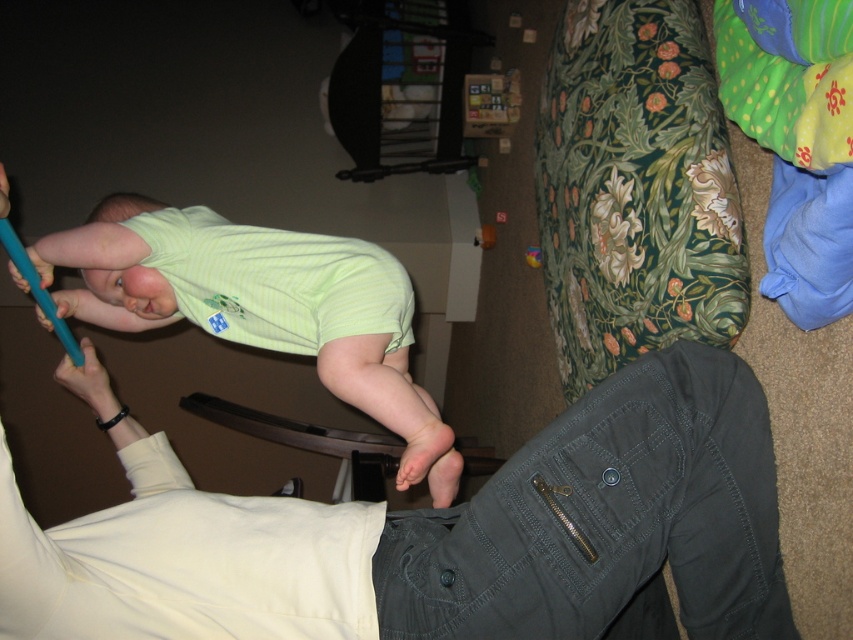
Which is behind, point (73, 256) or point (76, 300)?

Positioned behind is point (76, 300).

Which is behind, point (155, 220) or point (74, 308)?

The point (74, 308) is behind.

At what (x,y) coordinates should I click in order to perform the action: click on light green fabric at upper left. Please return your answer as a coordinate pair (x, y). This screenshot has height=640, width=853. Looking at the image, I should click on (277, 278).

Measure the distance between dark gray pants at lower right and camera.

dark gray pants at lower right is 32.38 inches away from camera.

Is dark gray pants at lower right further to the viewer compared to pink matte flesh at center?

No, dark gray pants at lower right is closer to the viewer.

Locate an element on the screen. Image resolution: width=853 pixels, height=640 pixels. dark gray pants at lower right is located at coordinates (439, 534).

This screenshot has height=640, width=853. What are the coordinates of `dark gray pants at lower right` in the screenshot? It's located at (439, 534).

Can you confirm if matte blue pen at lower left is positioned below pink matte flesh at center?

Indeed, matte blue pen at lower left is positioned under pink matte flesh at center.

Does matte blue pen at lower left have a larger size compared to pink matte flesh at center?

Yes, matte blue pen at lower left is bigger than pink matte flesh at center.

At what (x,y) coordinates should I click in order to perform the action: click on matte blue pen at lower left. Please return your answer as a coordinate pair (x, y). The image size is (853, 640). Looking at the image, I should click on (88, 380).